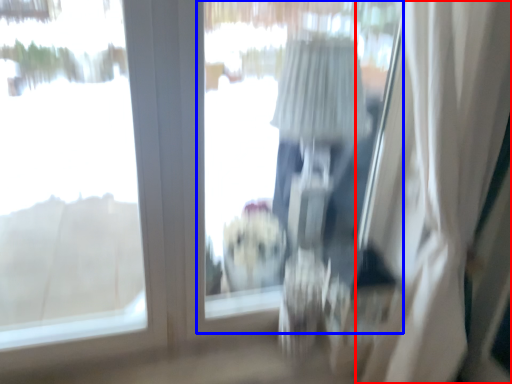
Question: Which point is further to the camera, curtain (highlighted by a red box) or window screen (highlighted by a blue box)?

Choices:
 (A) curtain
 (B) window screen

Answer: (B)